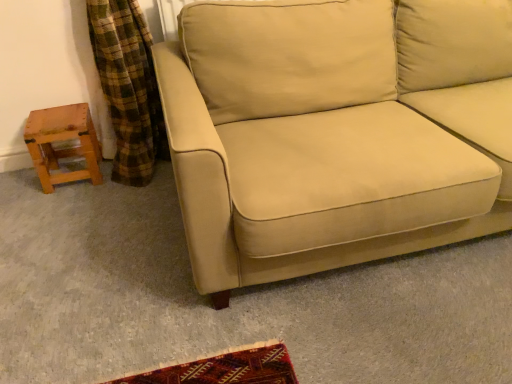
Question: Considering the relative positions of wooden stool at left and beige fabric couch at center in the image provided, is wooden stool at left to the right of beige fabric couch at center from the viewer's perspective?

Choices:
 (A) yes
 (B) no

Answer: (B)

Question: Is wooden stool at left thinner than beige fabric couch at center?

Choices:
 (A) yes
 (B) no

Answer: (A)

Question: Is wooden stool at left with beige fabric couch at center?

Choices:
 (A) yes
 (B) no

Answer: (B)

Question: Is wooden stool at left outside of beige fabric couch at center?

Choices:
 (A) no
 (B) yes

Answer: (B)

Question: Can you confirm if wooden stool at left is shorter than beige fabric couch at center?

Choices:
 (A) no
 (B) yes

Answer: (B)

Question: Can you confirm if wooden stool at left is bigger than beige fabric couch at center?

Choices:
 (A) no
 (B) yes

Answer: (A)

Question: Can you confirm if beige fabric couch at center is taller than wooden stool at left?

Choices:
 (A) no
 (B) yes

Answer: (B)

Question: From a real-world perspective, is beige fabric couch at center beneath wooden stool at left?

Choices:
 (A) yes
 (B) no

Answer: (B)

Question: From the image's perspective, is beige fabric couch at center above wooden stool at left?

Choices:
 (A) no
 (B) yes

Answer: (B)

Question: Does beige fabric couch at center lie in front of wooden stool at left?

Choices:
 (A) yes
 (B) no

Answer: (A)

Question: Can you confirm if beige fabric couch at center is wider than wooden stool at left?

Choices:
 (A) no
 (B) yes

Answer: (B)

Question: Is beige fabric couch at center not close to wooden stool at left?

Choices:
 (A) no
 (B) yes

Answer: (B)

Question: From their relative heights in the image, would you say beige fabric couch at center is taller or shorter than wooden stool at left?

Choices:
 (A) short
 (B) tall

Answer: (B)